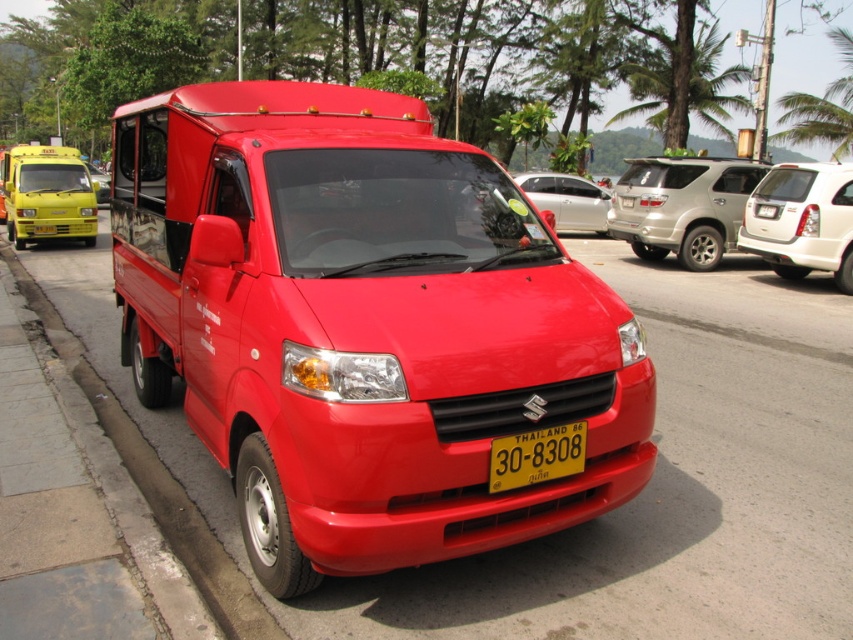
Can you confirm if white glossy minivan at right is shorter than silver metallic sedan at center?

Incorrect, white glossy minivan at right's height does not fall short of silver metallic sedan at center's.

Which is above, white glossy minivan at right or silver metallic sedan at center?

Positioned higher is silver metallic sedan at center.

Which is behind, point (784, 252) or point (581, 228)?

Positioned behind is point (581, 228).

Identify the location of white glossy minivan at right. Image resolution: width=853 pixels, height=640 pixels. (802, 220).

Which is in front, point (778, 198) or point (4, 195)?

Point (778, 198) is more forward.

Does white glossy minivan at right appear on the left side of yellow matte taxi at left?

Incorrect, white glossy minivan at right is not on the left side of yellow matte taxi at left.

This screenshot has width=853, height=640. Describe the element at coordinates (802, 220) in the screenshot. I see `white glossy minivan at right` at that location.

Where is `white glossy minivan at right`? white glossy minivan at right is located at coordinates (802, 220).

Which of these two, yellow matte license plate at center or silver metallic sedan at center, stands shorter?

yellow matte license plate at center is shorter.

In the scene shown: Which is above, yellow matte license plate at center or silver metallic sedan at center?

silver metallic sedan at center is higher up.

Who is more distant from viewer, (x=497, y=468) or (x=541, y=204)?

Positioned behind is point (x=541, y=204).

Where is `yellow matte license plate at center`? The width and height of the screenshot is (853, 640). yellow matte license plate at center is located at coordinates (537, 456).